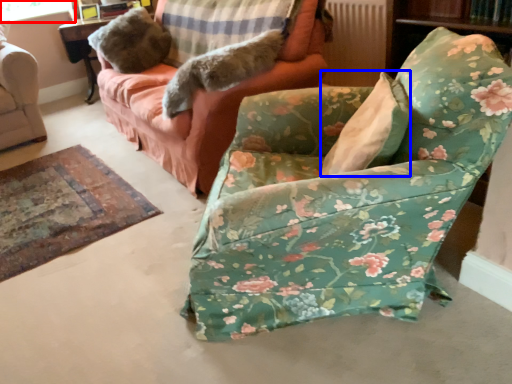
Question: Which object appears closest to the camera in this image, window screen (highlighted by a red box) or pillow (highlighted by a blue box)?

Choices:
 (A) window screen
 (B) pillow

Answer: (B)